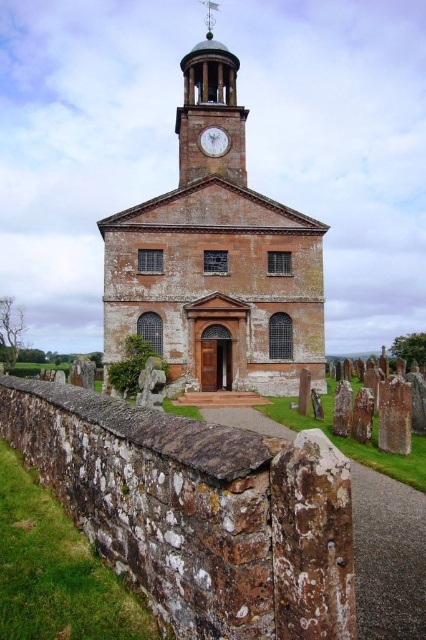
Question: Which point is farther from the camera taking this photo?

Choices:
 (A) (215, 132)
 (B) (140, 276)
 (C) (236, 93)

Answer: (C)

Question: Can you confirm if light brown stone clock tower at upper center is thinner than white glossy clock at upper center?

Choices:
 (A) no
 (B) yes

Answer: (A)

Question: Is light brown stone clock tower at upper center to the left of white glossy clock at upper center from the viewer's perspective?

Choices:
 (A) yes
 (B) no

Answer: (A)

Question: Among these points, which one is nearest to the camera?

Choices:
 (A) (229, 104)
 (B) (226, 264)

Answer: (B)

Question: Which of the following is the closest to the observer?

Choices:
 (A) (229, 141)
 (B) (308, 273)
 (C) (203, 115)

Answer: (B)

Question: Does brown stone church at center come behind white glossy clock at upper center?

Choices:
 (A) no
 (B) yes

Answer: (A)